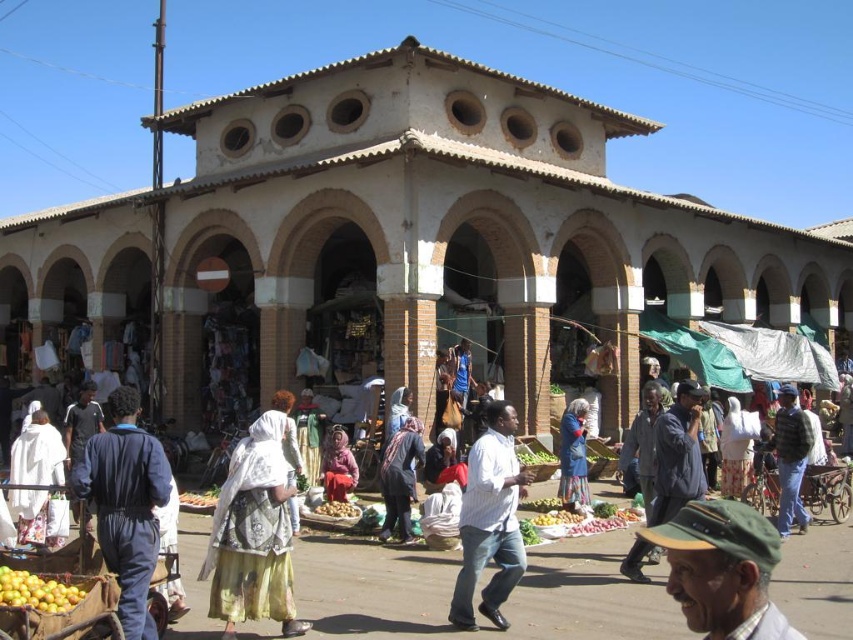
Based on the photo, you are standing in the market and want to take a photo of both point [654,541] and point [583,499] in the same frame. Which point should you position closer to the center of your camera viewfinder to ensure both are visible?

You should position point [654,541] closer to the center of your camera viewfinder because it is closer to the camera than point [583,499], so it will appear larger in the frame. By centering the closer point, you can adjust the zoom to include both points within the same frame.

You are a vendor at the market and want to arrange your fabrics in a specific order. You have a dark gray fabric headscarf at center and a blue fabric at center. According to the current arrangement, which fabric is on the left side?

The dark gray fabric headscarf at center is positioned on the left side of the blue fabric at center.

You are a vendor at the market and need to decide which fabric to use for a new product. The green fabric cap at lower right and the blue fabric at center are both available. If you want to choose the wider fabric, which one should you pick?

The green fabric cap at lower right is wider than the blue fabric at center, so you should pick the green fabric cap at lower right.